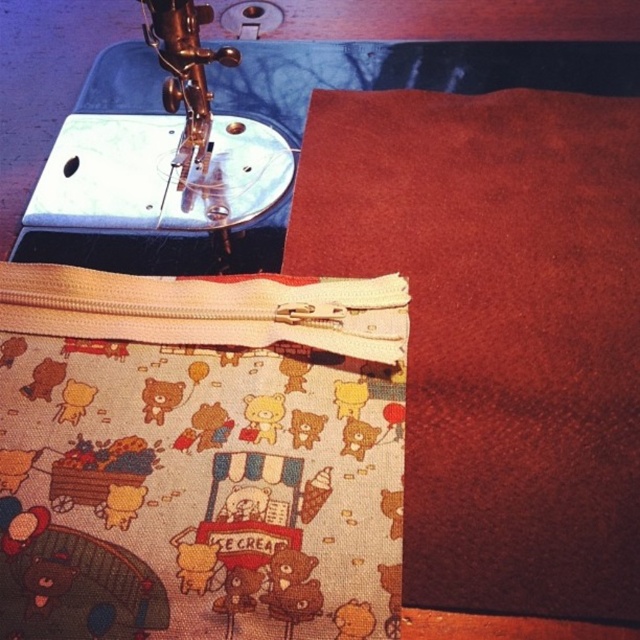
Which is more to the left, matte brown fabric at center or metallic sewing machine at upper left?

Positioned to the left is metallic sewing machine at upper left.

Is matte brown fabric at center below metallic sewing machine at upper left?

Correct, matte brown fabric at center is located below metallic sewing machine at upper left.

Is point (442, 324) positioned behind point (230, 202)?

No, (442, 324) is in front of (230, 202).

Image resolution: width=640 pixels, height=640 pixels. What are the coordinates of `matte brown fabric at center` in the screenshot? It's located at (499, 332).

Does beige fabric pouch at center appear over metallic sewing machine at upper left?

Actually, beige fabric pouch at center is below metallic sewing machine at upper left.

Between beige fabric pouch at center and metallic sewing machine at upper left, which one is positioned higher?

metallic sewing machine at upper left

Which is in front, point (74, 634) or point (138, 176)?

Point (74, 634) is more forward.

Identify the location of beige fabric pouch at center. The width and height of the screenshot is (640, 640). (198, 456).

Is beige fabric pouch at center taller than matte brown fabric at center?

In fact, beige fabric pouch at center may be shorter than matte brown fabric at center.

Between point (156, 308) and point (627, 355), which one is positioned in front?

Point (627, 355) is more forward.

What do you see at coordinates (198, 456) in the screenshot?
I see `beige fabric pouch at center` at bounding box center [198, 456].

This screenshot has width=640, height=640. I want to click on beige fabric pouch at center, so click(x=198, y=456).